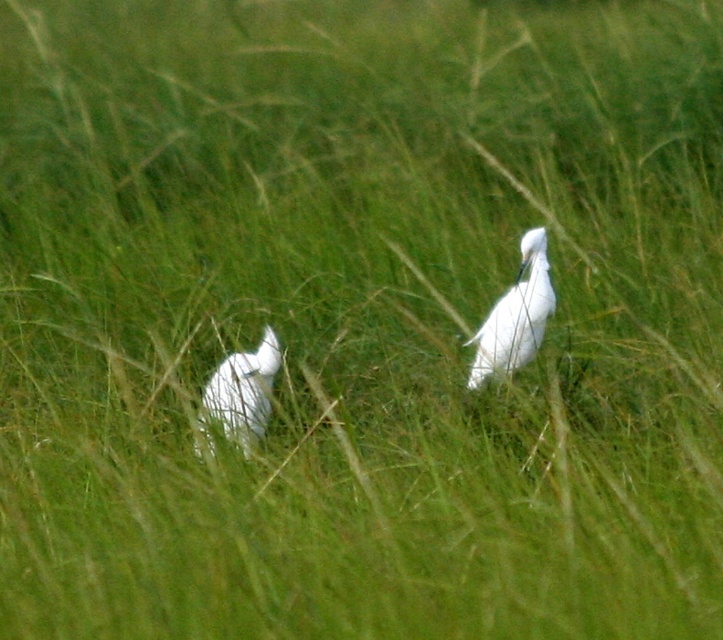
Which is above, white smooth bird at center or white feathered bird at center?

Positioned higher is white smooth bird at center.

Who is more forward, (471, 387) or (265, 433)?

Positioned in front is point (265, 433).

This screenshot has width=723, height=640. Find the location of `white smooth bird at center`. white smooth bird at center is located at coordinates (515, 316).